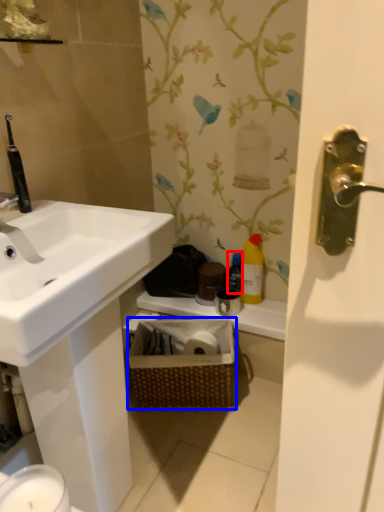
Question: Among these objects, which one is nearest to the camera, bottle (highlighted by a red box) or basket (highlighted by a blue box)?

Choices:
 (A) bottle
 (B) basket

Answer: (B)